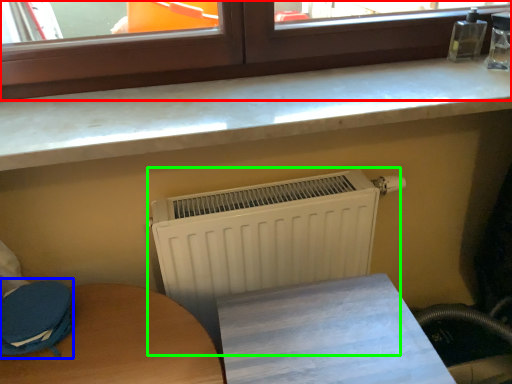
Question: Estimate the real-world distances between objects in this image. Which object is farther from window (highlighted by a red box), swivel chair (highlighted by a blue box) or radiator (highlighted by a green box)?

Choices:
 (A) swivel chair
 (B) radiator

Answer: (A)